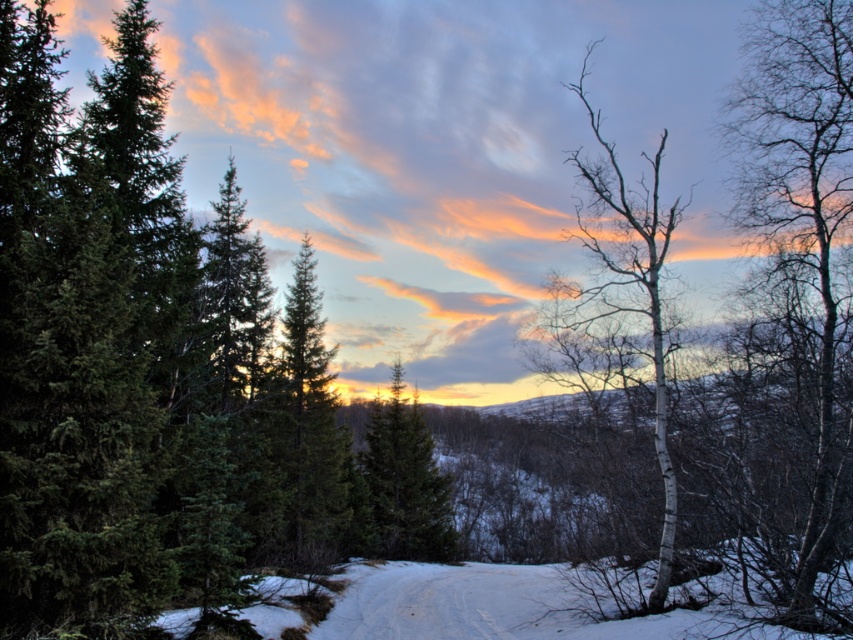
Consider the image. You are standing at the camera position looking at the winter landscape. There are two points marked in the scene, one at coordinates point (271,422) and another at point (380,406). Which point is closer to you?

Point (271,422) is closer to the camera than point (380,406).